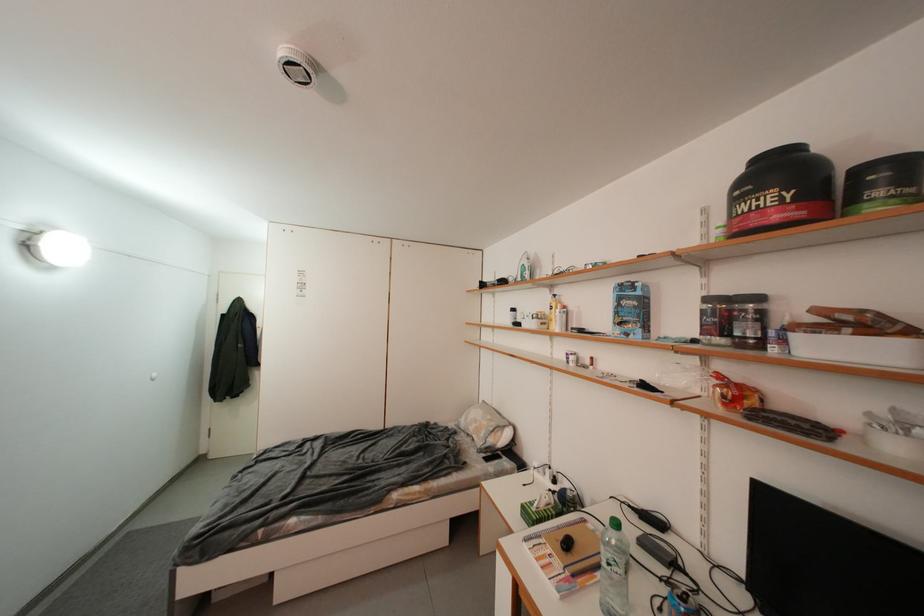
Find where to twist the green bottle cap. Please return your answer as a coordinate pair (x, y).

(614, 523)